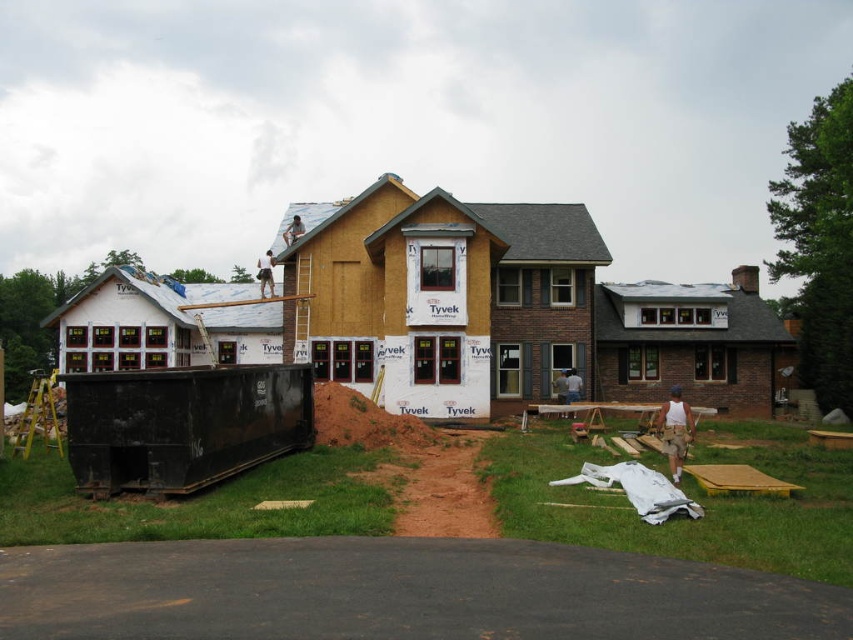
Looking at this image, you are standing at the construction site and want to reach the point marked as point (x=691, y=428). If your maximum comfortable walking distance is 15 meters, can you comfortably reach that point?

The point (x=691, y=428) is 14.00 meters from the viewer, so yes, you can comfortably reach it within your 15 meters limit.

Please write a question that asks about the position of the tan fabric construction worker at lower right in the scene, using the provided scene description and objects. Ensure the question does not reveal the exact coordinates from the Objects Description and adheres to the rules.

The tan fabric construction worker at lower right is located at the lower right area of the scene, near the construction area as per the coordinates provided.

From the picture: You are a safety inspector visiting the construction site. You notice two objects labeled as tan fabric construction worker at upper center and tan fabric shirt at lower right. Which object is located higher up in the image?

The tan fabric construction worker at upper center is positioned over the tan fabric shirt at lower right, so it is higher up in the image.